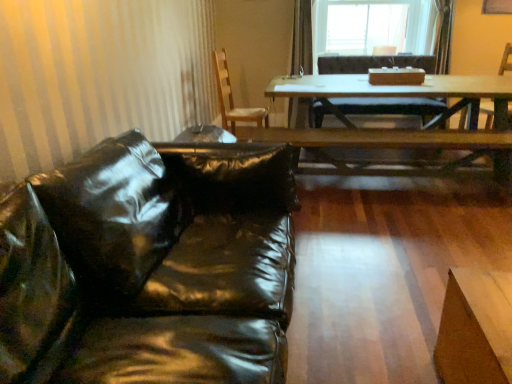
What are the coordinates of `glossy black leather couch at left` in the screenshot? It's located at (149, 266).

Find the location of `wooden chair at center, acting as the 2th chair starting from the right`. wooden chair at center, acting as the 2th chair starting from the right is located at coordinates (232, 98).

Describe the element at coordinates (232, 98) in the screenshot. This screenshot has height=384, width=512. I see `wooden chair at center, acting as the 2th chair starting from the right` at that location.

Describe the element at coordinates (400, 96) in the screenshot. This screenshot has width=512, height=384. I see `wooden table at center` at that location.

This screenshot has height=384, width=512. What are the coordinates of `wooden armchair at right` in the screenshot? It's located at (506, 60).

The width and height of the screenshot is (512, 384). What do you see at coordinates (506, 60) in the screenshot? I see `wooden armchair at right` at bounding box center [506, 60].

Identify the location of glossy black leather couch at left. This screenshot has height=384, width=512. (149, 266).

Between wooden armchair at right and wooden table at center, which one has less height?

wooden table at center is shorter.

Does wooden armchair at right touch wooden table at center?

wooden armchair at right and wooden table at center are not in contact.

Locate an element on the screen. The image size is (512, 384). armchair to the right of wooden table at center is located at coordinates (506, 60).

Between wooden armchair at right and wooden table at center, which one is positioned in front?

wooden table at center.

Considering the sizes of wooden table at center and wooden chair at center, acting as the 2th chair starting from the right, in the image, is wooden table at center wider or thinner than wooden chair at center, acting as the 2th chair starting from the right,?

wooden table at center is wider than wooden chair at center, acting as the 2th chair starting from the right.

Is wooden table at center aimed at wooden chair at center, which is counted as the first chair, starting from the left?

No.

From their relative heights in the image, would you say glossy black leather couch at left is taller or shorter than wooden armchair at right?

glossy black leather couch at left is shorter than wooden armchair at right.

This screenshot has height=384, width=512. Identify the location of armchair on the right of glossy black leather couch at left. (506, 60).

From the image's perspective, which one is positioned higher, glossy black leather couch at left or wooden armchair at right?

wooden armchair at right is shown above in the image.

Looking at this image, from the image's perspective, which is above, wooden armchair at right or transparent plastic window screen at upper center?

transparent plastic window screen at upper center, from the image's perspective.

Where is `window screen that appears above the wooden armchair at right (from a real-world perspective)`? The height and width of the screenshot is (384, 512). window screen that appears above the wooden armchair at right (from a real-world perspective) is located at coordinates (374, 26).

What's the angular difference between wooden armchair at right and transparent plastic window screen at upper center's facing directions?

55.6 degrees separate the facing orientations of wooden armchair at right and transparent plastic window screen at upper center.

Do you think wooden armchair at right is within transparent plastic window screen at upper center, or outside of it?

wooden armchair at right cannot be found inside transparent plastic window screen at upper center.

Considering the positions of objects wooden chair at center, acting as the 2th chair starting from the right, and transparent plastic window screen at upper center in the image provided, who is more to the right, wooden chair at center, acting as the 2th chair starting from the right, or transparent plastic window screen at upper center?

transparent plastic window screen at upper center is more to the right.

In terms of height, does wooden chair at center, which is counted as the first chair, starting from the left, look taller or shorter compared to transparent plastic window screen at upper center?

Clearly, wooden chair at center, which is counted as the first chair, starting from the left, is taller compared to transparent plastic window screen at upper center.

Is wooden chair at center, acting as the 2th chair starting from the right, completely or partially outside of transparent plastic window screen at upper center?

Yes.

Image resolution: width=512 pixels, height=384 pixels. I want to click on chair that is the 2nd object to the left of the transparent plastic window screen at upper center, starting at the anchor, so click(x=232, y=98).

In the scene shown: Are wooden table at center and wooden armchair at right beside each other?

No, wooden table at center is not beside wooden armchair at right.

Can we say wooden table at center lies outside wooden armchair at right?

That's correct, wooden table at center is outside of wooden armchair at right.

From the picture: Is wooden table at center facing away from wooden armchair at right?

Absolutely, wooden table at center is directed away from wooden armchair at right.

Measure the distance from wooden table at center to wooden armchair at right.

They are 1.05 meters apart.

From the picture: Does wooden chair at center, acting as the 2th chair starting from the right, have a larger size compared to glossy black leather couch at left?

Actually, wooden chair at center, acting as the 2th chair starting from the right, might be smaller than glossy black leather couch at left.

Can we say wooden chair at center, acting as the 2th chair starting from the right, lies outside glossy black leather couch at left?

That's correct, wooden chair at center, acting as the 2th chair starting from the right, is outside of glossy black leather couch at left.

Which is behind, point (258, 116) or point (2, 216)?

The point (258, 116) is farther.

Which object is thinner, wooden chair at center, which is counted as the first chair, starting from the left, or glossy black leather couch at left?

wooden chair at center, which is counted as the first chair, starting from the left, is thinner.

At what (x,y) coordinates should I click in order to perform the action: click on armchair behind the wooden table at center. Please return your answer as a coordinate pair (x, y). The image size is (512, 384). Looking at the image, I should click on (506, 60).

This screenshot has width=512, height=384. Find the location of `chair on the left side of wooden table at center`. chair on the left side of wooden table at center is located at coordinates (x=232, y=98).

Which object lies further to the anchor point transparent plastic window screen at upper center, glossy black leather couch at left or wooden table at center?

Based on the image, glossy black leather couch at left appears to be further to transparent plastic window screen at upper center.

When comparing their distances from wooden chair at center, acting as the 2th chair starting from the right, does transparent plastic window screen at upper center or brown leather chair at upper right, the 2th chair when ordered from left to right, seem further?

transparent plastic window screen at upper center.

Looking at this image, based on their spatial positions, is wooden table at center or transparent plastic window screen at upper center further from glossy black leather couch at left?

Based on the image, transparent plastic window screen at upper center appears to be further to glossy black leather couch at left.

Looking at the image, which one is located closer to wooden chair at center, which is counted as the first chair, starting from the left, brown leather chair at upper right, the 2th chair when ordered from left to right, or glossy black leather couch at left?

brown leather chair at upper right, the 2th chair when ordered from left to right, is closer to wooden chair at center, which is counted as the first chair, starting from the left.

Considering their positions, is wooden chair at center, acting as the 2th chair starting from the right, positioned further to transparent plastic window screen at upper center than wooden armchair at right?

The object further to transparent plastic window screen at upper center is wooden armchair at right.

Considering their positions, is wooden chair at center, acting as the 2th chair starting from the right, positioned closer to glossy black leather couch at left than wooden armchair at right?

wooden armchair at right.

From the picture: Based on their spatial positions, is wooden armchair at right or transparent plastic window screen at upper center closer to wooden chair at center, acting as the 2th chair starting from the right?

transparent plastic window screen at upper center.

Which object lies further to the anchor point wooden table at center, transparent plastic window screen at upper center or glossy black leather couch at left?

Based on the image, glossy black leather couch at left appears to be further to wooden table at center.

I want to click on table between wooden chair at center, acting as the 2th chair starting from the right, and wooden armchair at right, in the horizontal direction, so click(400, 96).

Locate an element on the screen. This screenshot has height=384, width=512. table between wooden chair at center, which is counted as the first chair, starting from the left, and brown leather chair at upper right, the 2th chair when ordered from left to right, from left to right is located at coordinates (400, 96).

Where is `table between glossy black leather couch at left and brown leather chair at upper right, the 2th chair when ordered from left to right, from front to back`? This screenshot has width=512, height=384. table between glossy black leather couch at left and brown leather chair at upper right, the 2th chair when ordered from left to right, from front to back is located at coordinates (400, 96).

The width and height of the screenshot is (512, 384). I want to click on window screen situated between brown leather chair at upper right, the 2th chair when ordered from left to right, and wooden armchair at right from left to right, so click(x=374, y=26).